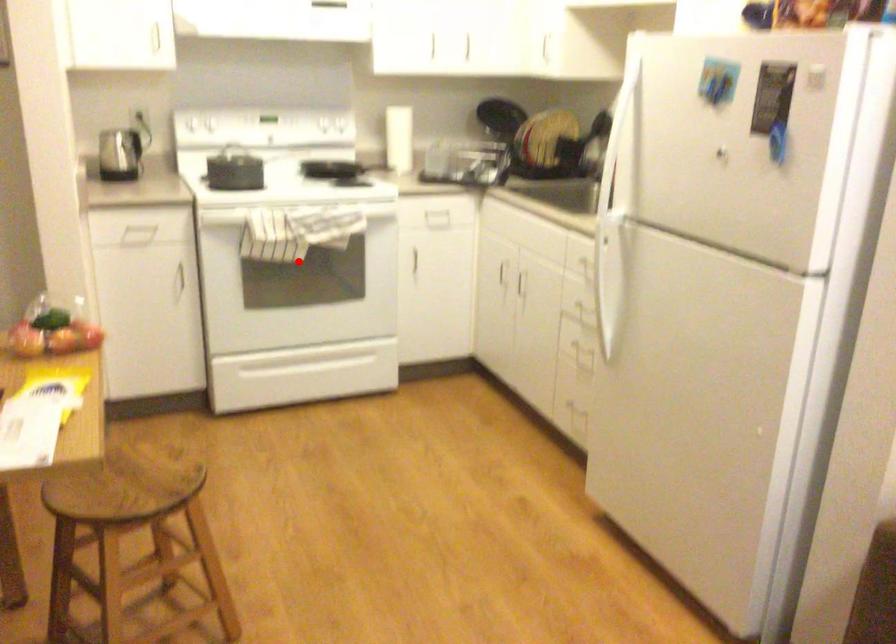
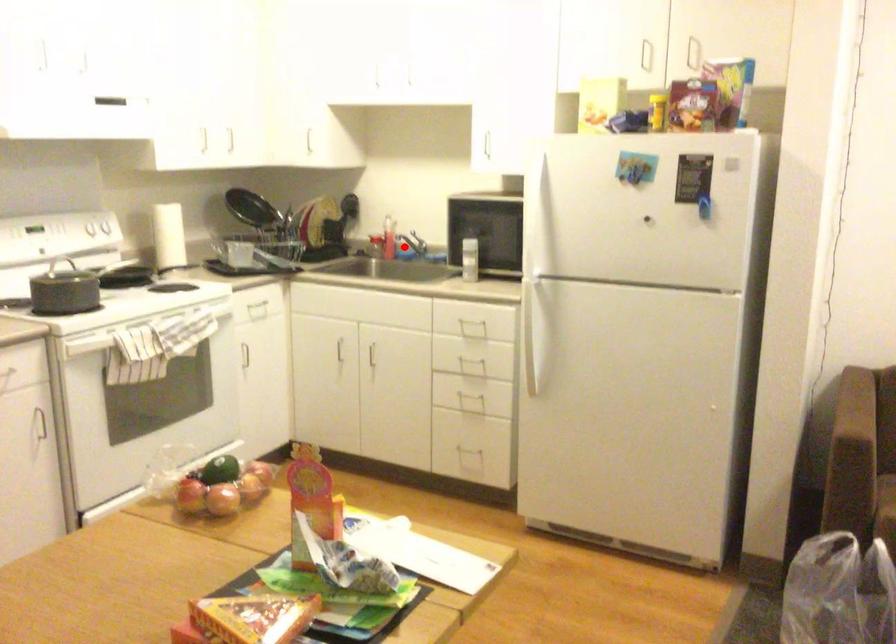
I am providing you with two images of the same scene from different viewpoints. A red point is marked on the first image and another point is marked on the second image. Do the highlighted points in image1 and image2 indicate the same real-world spot?

No